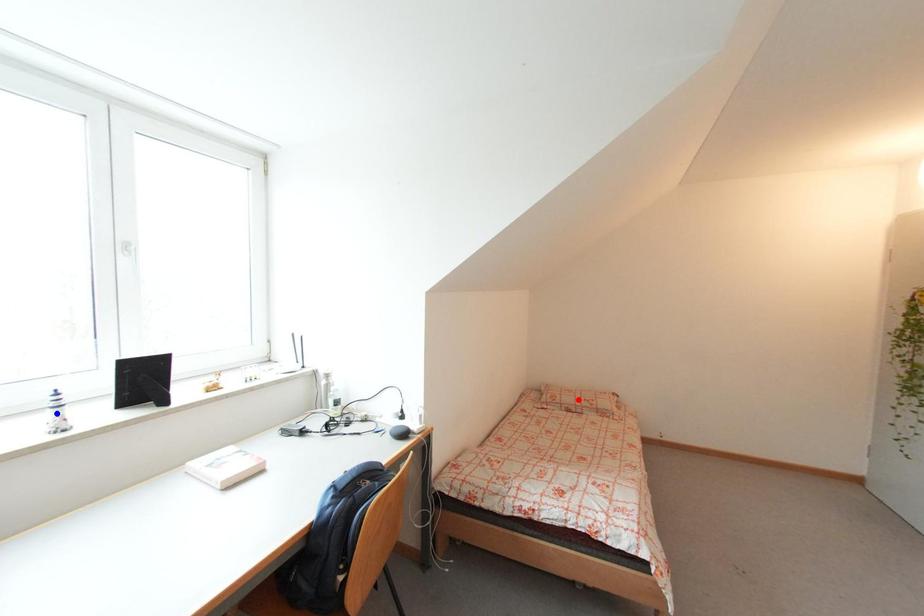
Question: Two points are marked on the image. Which point is closer to the camera?

Choices:
 (A) Blue point is closer.
 (B) Red point is closer.

Answer: (A)